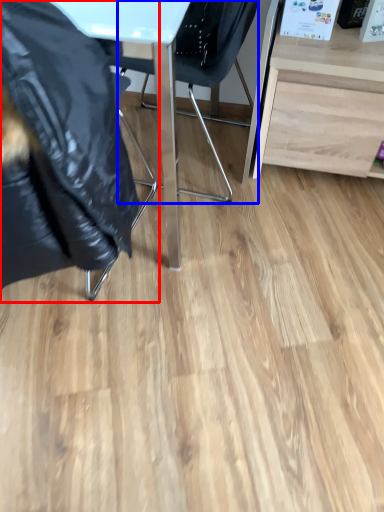
Question: Which of the following is the farthest to the observer, chair (highlighted by a red box) or chair (highlighted by a blue box)?

Choices:
 (A) chair
 (B) chair

Answer: (B)